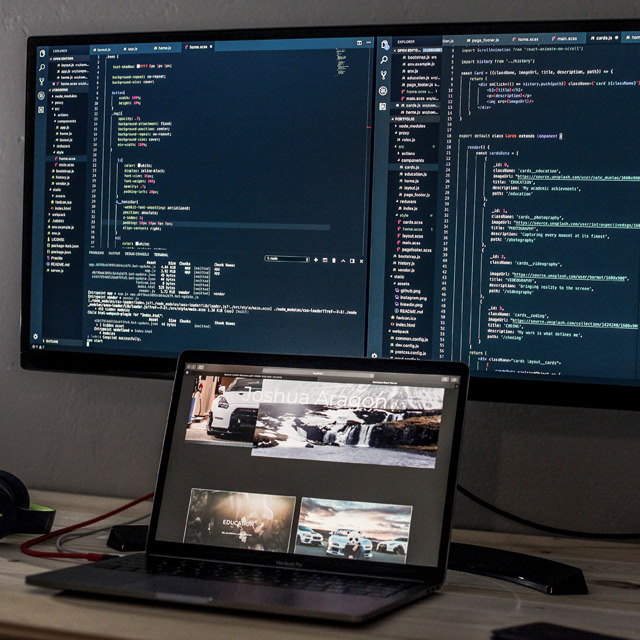
Find the location of `wires`. wires is located at coordinates (132, 500), (100, 528), (513, 516).